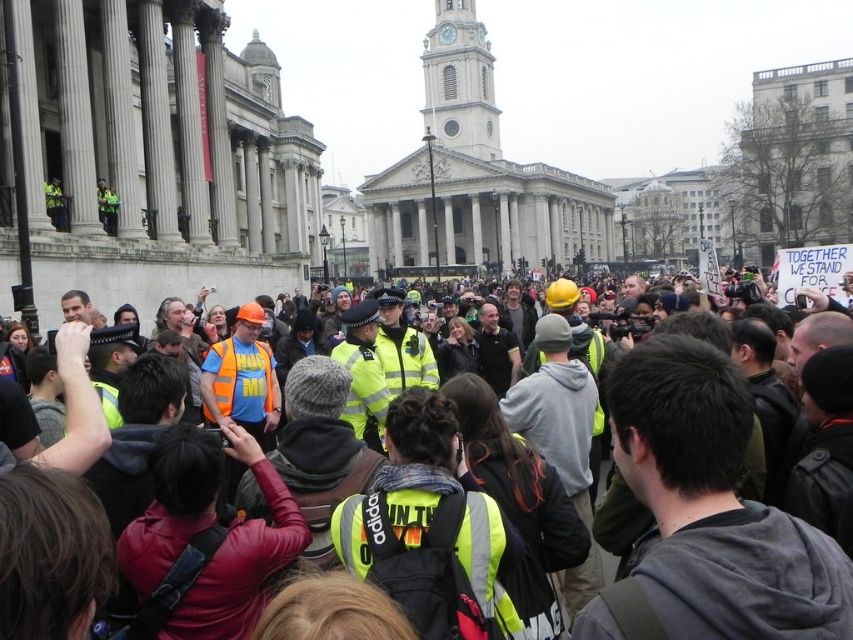
Does yellow reflective vests at center appear on the right side of neon yellow safety vest at center?

Yes, yellow reflective vests at center is to the right of neon yellow safety vest at center.

Identify the location of yellow reflective vests at center. (715, 506).

This screenshot has height=640, width=853. In order to click on yellow reflective vests at center in this screenshot , I will do `click(715, 506)`.

Locate an element on the screen. Image resolution: width=853 pixels, height=640 pixels. yellow reflective vests at center is located at coordinates (715, 506).

Is yellow reflective vests at center in front of reflective orange safety vest at center?

Yes, yellow reflective vests at center is closer to the viewer.

The width and height of the screenshot is (853, 640). What do you see at coordinates (715, 506) in the screenshot?
I see `yellow reflective vests at center` at bounding box center [715, 506].

Where is `yellow reflective vests at center`? yellow reflective vests at center is located at coordinates (715, 506).

Does point (511, 541) come closer to viewer compared to point (229, 392)?

That is True.

Does neon yellow safety vest at center appear under reflective orange safety vest at center?

Yes, neon yellow safety vest at center is below reflective orange safety vest at center.

Looking at this image, who is more distant from viewer, (419, 536) or (231, 376)?

Point (231, 376)

At what (x,y) coordinates should I click in order to perform the action: click on neon yellow safety vest at center. Please return your answer as a coordinate pair (x, y). Looking at the image, I should click on (412, 496).